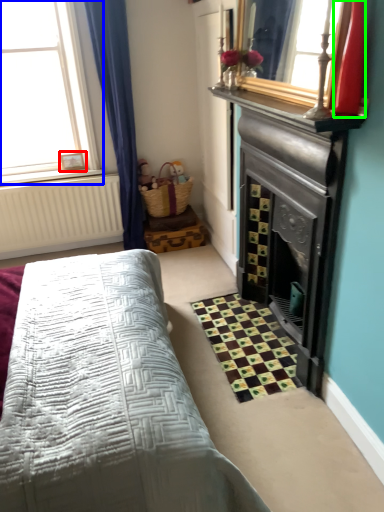
Question: Which object is the closest to the picture frame (highlighted by a red box)? Choose among these: window (highlighted by a blue box) or chiffonier (highlighted by a green box).

Choices:
 (A) window
 (B) chiffonier

Answer: (A)